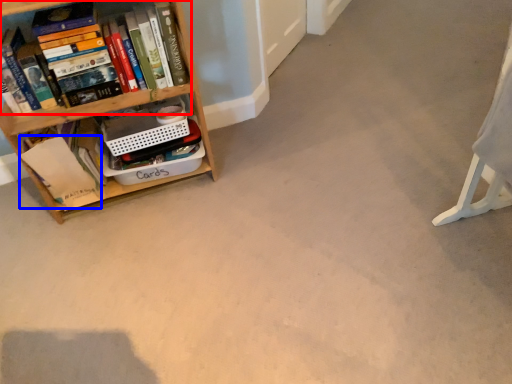
Question: Which object appears farthest to the camera in this image, book (highlighted by a red box) or paperback book (highlighted by a blue box)?

Choices:
 (A) book
 (B) paperback book

Answer: (B)